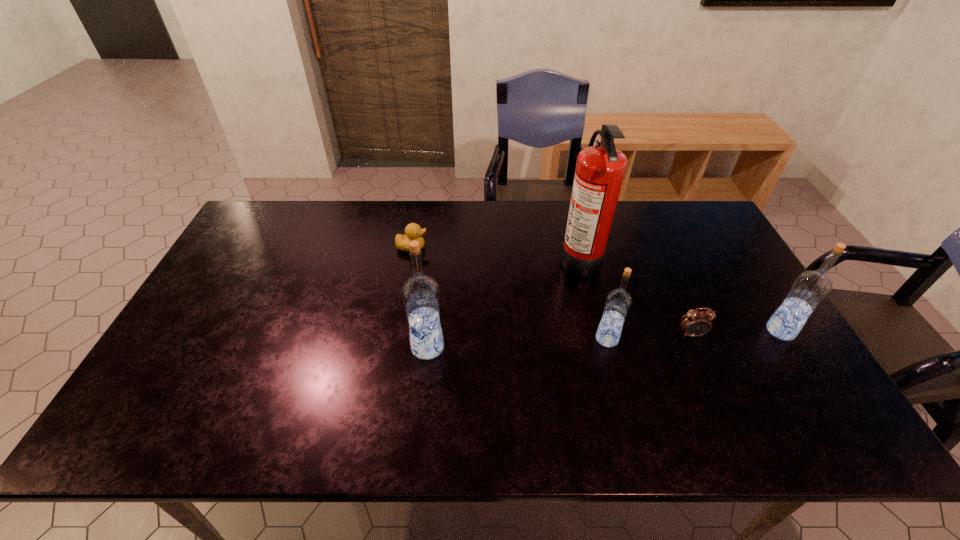
With all vodkas evenly spaced, where should an extra vodka be placed on the left to continue the pattern? Please point out a vacant space. Please provide its 2D coordinates. Your answer should be formatted as a tuple, i.e. [(x, y)], where the tuple contains the x and y coordinates of a point satisfying the conditions above.

[(242, 355)]